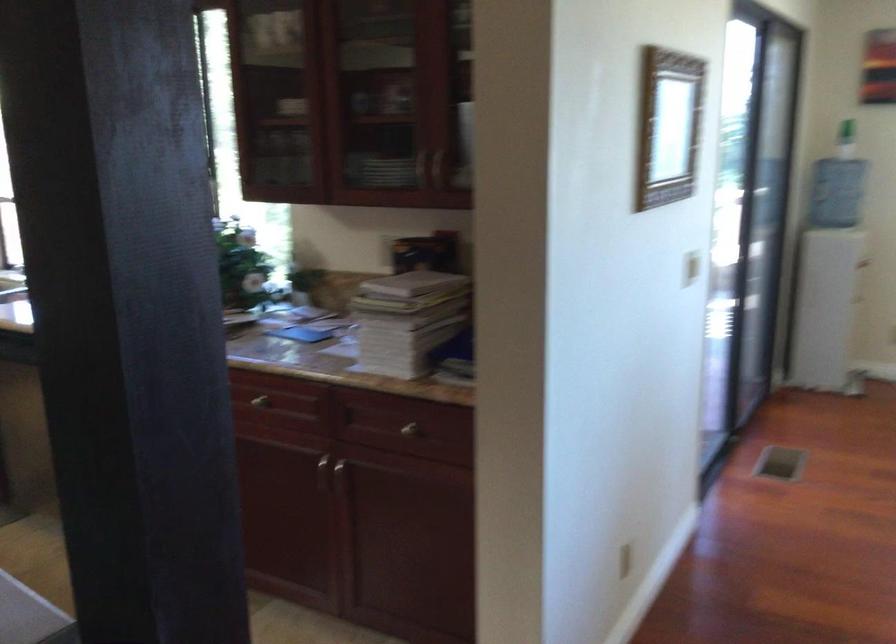
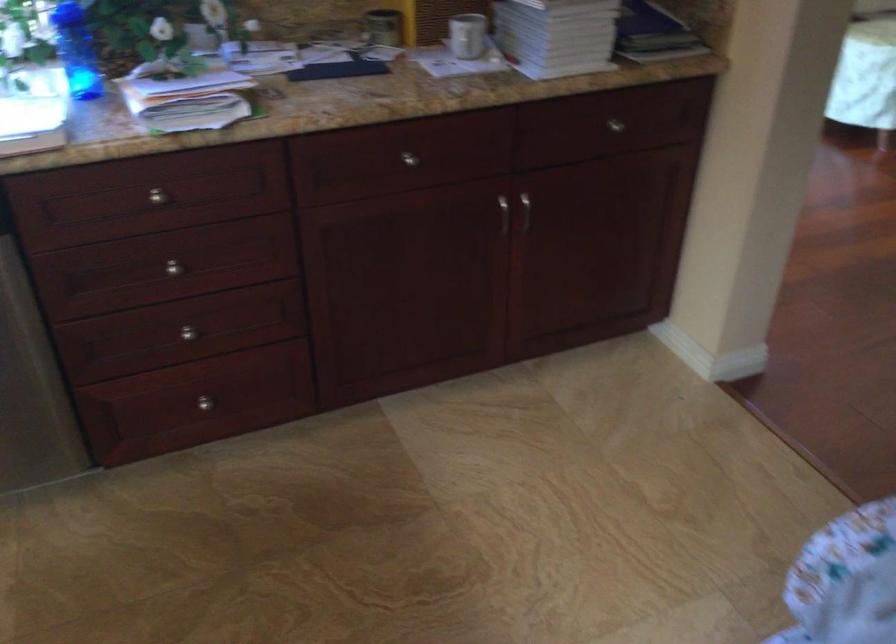
In the second image, find the point that corresponds to point (407, 431) in the first image.

(615, 125)